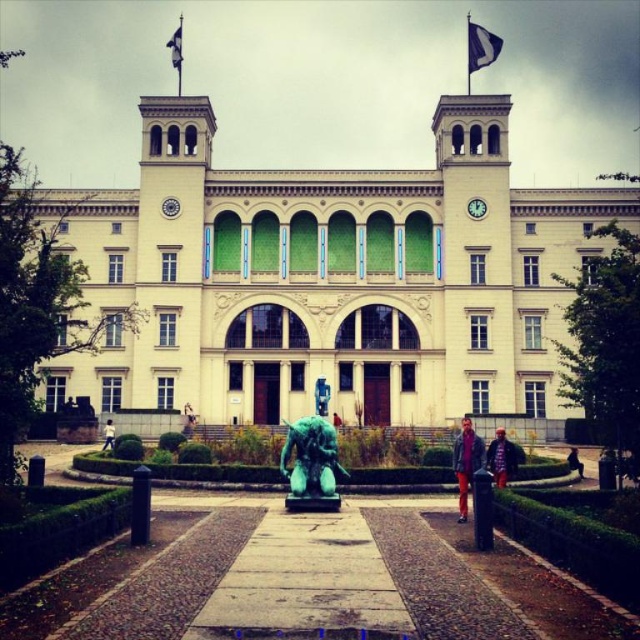
Question: Is matte purple jacket at center further to camera compared to red fabric jacket at center?

Choices:
 (A) no
 (B) yes

Answer: (A)

Question: Which point is farther from the camera taking this photo?

Choices:
 (A) (323, 486)
 (B) (112, 426)
 (C) (502, 444)
 (D) (576, 456)

Answer: (B)

Question: Which of the following is the closest to the observer?

Choices:
 (A) green patinated bronze statue at center
 (B) dark brown leather jacket at lower right

Answer: (A)

Question: Can you confirm if green metallic statue at center is positioned below red fabric jacket at center?

Choices:
 (A) yes
 (B) no

Answer: (A)

Question: Is white stone building at center to the right of red fabric jacket at center from the viewer's perspective?

Choices:
 (A) no
 (B) yes

Answer: (B)

Question: Which is nearer to the white matte statue at center?

Choices:
 (A) red fabric jacket at center
 (B) green metallic statue at center
 (C) green patinated bronze statue at center

Answer: (C)